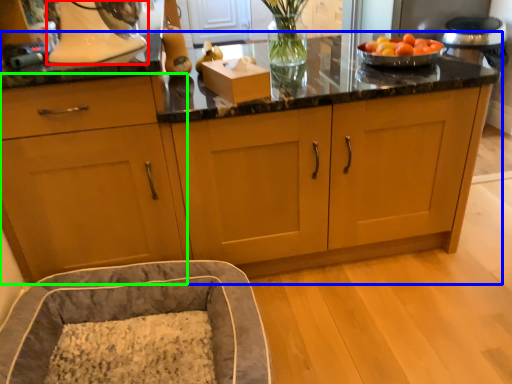
Question: Based on their relative distances, which object is nearer to home appliance (highlighted by a red box)? Choose from cabinetry (highlighted by a blue box) and cabinetry (highlighted by a green box).

Choices:
 (A) cabinetry
 (B) cabinetry

Answer: (B)